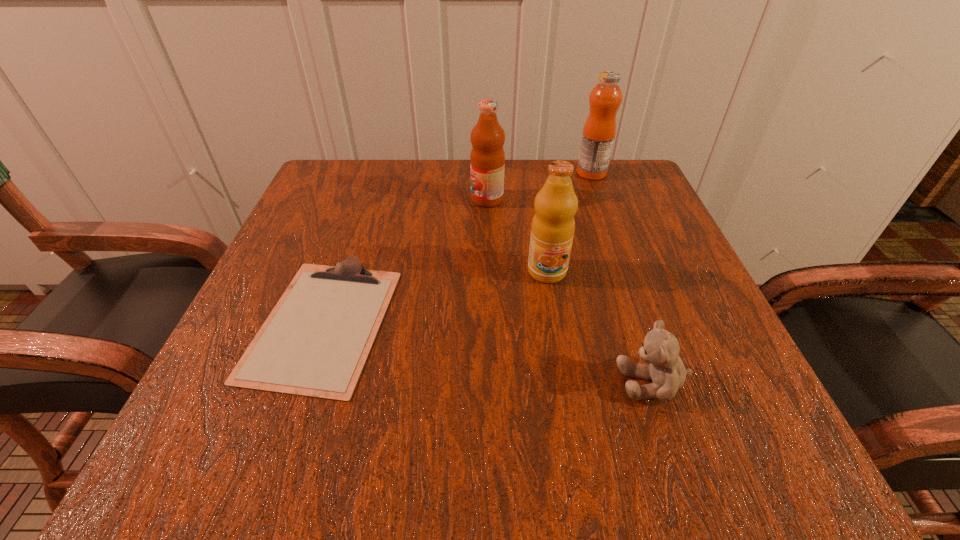
Locate an element on the screen. Image resolution: width=960 pixels, height=540 pixels. vacant space situated on the front label of the second farthest object is located at coordinates (307, 199).

Find the location of a particular element. vacant space located 0.360m on the front label of the second farthest object is located at coordinates (307, 199).

Where is `free space located on the front label of the second farthest object`? This screenshot has width=960, height=540. free space located on the front label of the second farthest object is located at coordinates (362, 199).

Find the location of a particular element. This screenshot has width=960, height=540. vacant space located on the front label of the second fruit juice from left to right is located at coordinates (567, 395).

This screenshot has width=960, height=540. Identify the location of vacant space located on the face of the second shortest object. (435, 382).

This screenshot has height=540, width=960. I want to click on vacant region located 0.340m on the face of the second shortest object, so click(x=378, y=382).

Identify the location of free space located on the face of the second shortest object. This screenshot has width=960, height=540. (554, 382).

Image resolution: width=960 pixels, height=540 pixels. Identify the location of free region located 0.240m on the back of the clipboard. (368, 193).

Locate an element on the screen. This screenshot has height=540, width=960. object that is at the left edge is located at coordinates (315, 342).

Image resolution: width=960 pixels, height=540 pixels. What are the coordinates of `fruit juice that is at the right edge` in the screenshot? It's located at (599, 130).